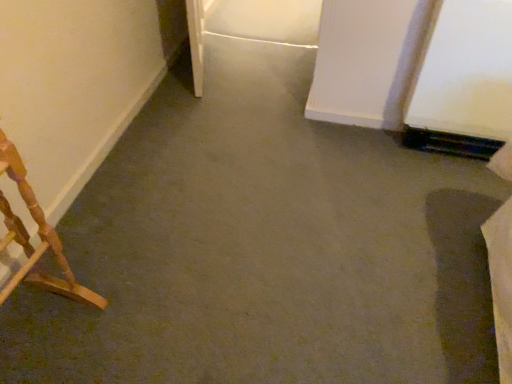
Find the location of a particular element. The width and height of the screenshot is (512, 384). wooden chair at left is located at coordinates (39, 236).

Describe the element at coordinates (39, 236) in the screenshot. I see `wooden chair at left` at that location.

At what (x,y) coordinates should I click in order to perform the action: click on wooden chair at left. Please return your answer as a coordinate pair (x, y). This screenshot has height=384, width=512. Looking at the image, I should click on (39, 236).